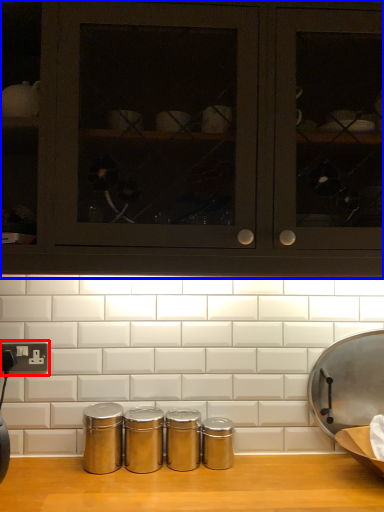
Question: Which of the following is the closest to the observer, electric outlet (highlighted by a red box) or cabinetry (highlighted by a blue box)?

Choices:
 (A) electric outlet
 (B) cabinetry

Answer: (B)